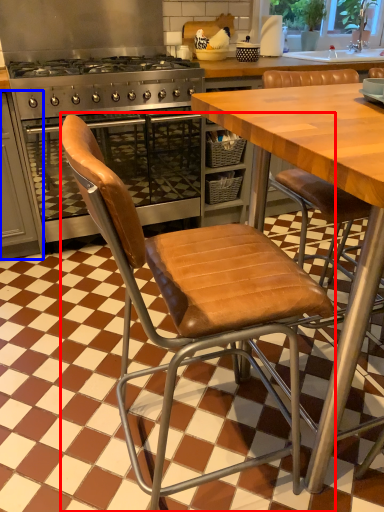
Question: Which object is closer to the camera taking this photo, chair (highlighted by a red box) or cabinetry (highlighted by a blue box)?

Choices:
 (A) chair
 (B) cabinetry

Answer: (A)